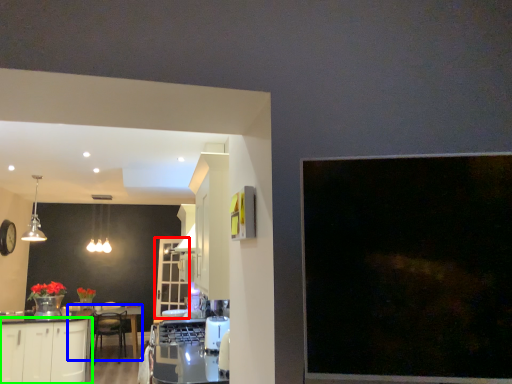
Question: Based on their relative distances, which object is nearer to glass door (highlighted by a red box)? Choose from round table (highlighted by a blue box) and cabinetry (highlighted by a green box).

Choices:
 (A) round table
 (B) cabinetry

Answer: (A)